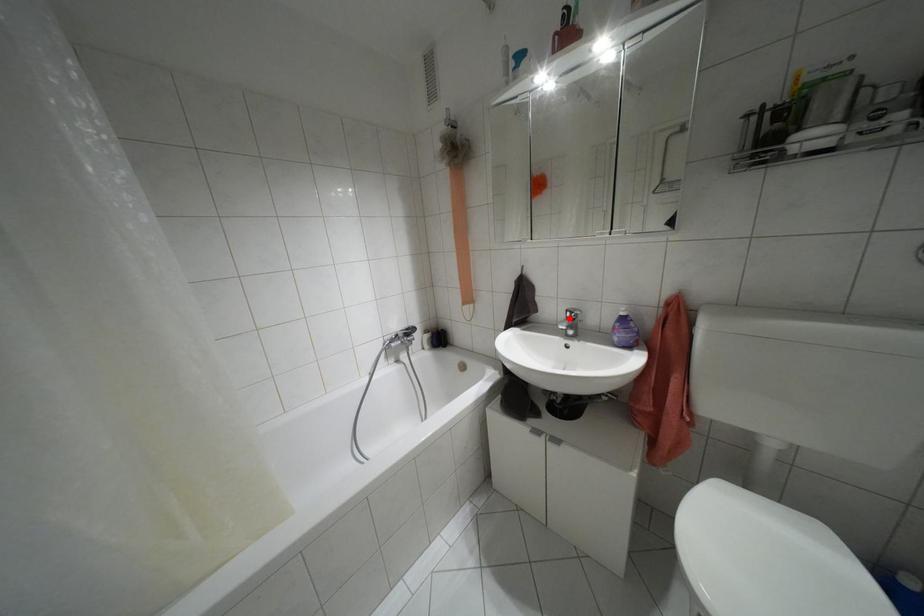
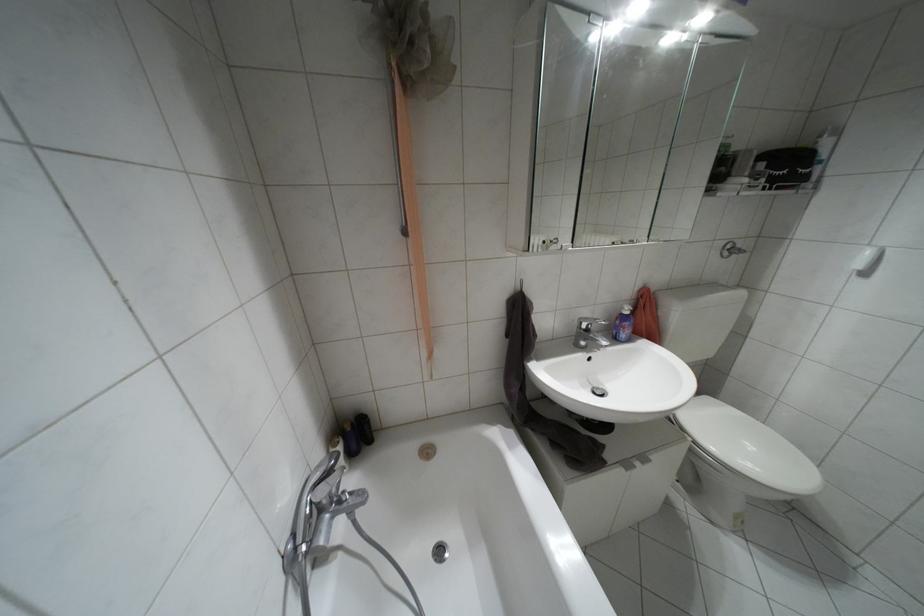
Find the pixel in the second image that matches the highlighted location in the first image.

(587, 330)